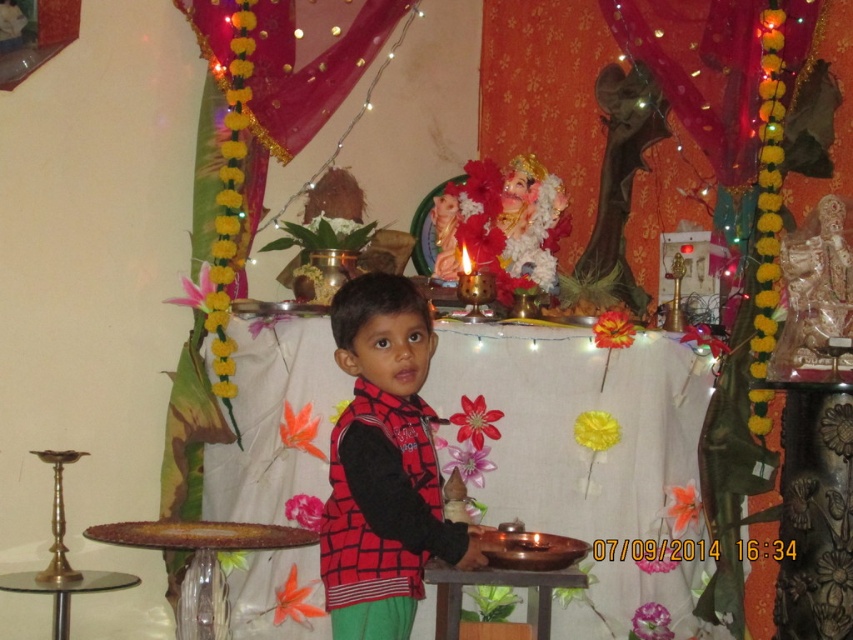
Question: Which of the following is the closest to the observer?

Choices:
 (A) shiny brass tray at center
 (B) red checkered vest at center

Answer: (B)

Question: Among these objects, which one is nearest to the camera?

Choices:
 (A) shiny brass tray at center
 (B) red checkered vest at center

Answer: (B)

Question: From the image, what is the correct spatial relationship of shiny brass tray at center in relation to red checkered vest at center?

Choices:
 (A) above
 (B) below

Answer: (B)

Question: Which point is farther from the camera taking this photo?

Choices:
 (A) (675, 445)
 (B) (407, 634)

Answer: (A)

Question: Does shiny brass tray at center lie behind red checkered vest at center?

Choices:
 (A) yes
 (B) no

Answer: (A)

Question: Can you confirm if shiny brass tray at center is positioned to the right of red checkered vest at center?

Choices:
 (A) no
 (B) yes

Answer: (B)